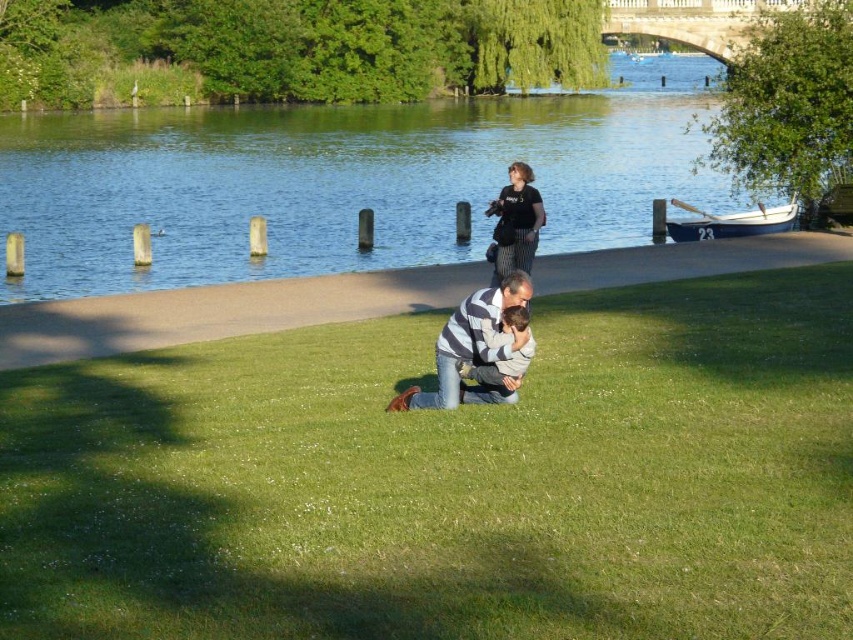
Can you confirm if green grass at center is wider than striped knit sweater at center?

Correct, the width of green grass at center exceeds that of striped knit sweater at center.

Who is more forward, (227,528) or (491,323)?

Point (227,528) is in front.

Which is behind, point (718, 308) or point (521, 339)?

The point (718, 308) is behind.

Where is `green grass at center`? green grass at center is located at coordinates (448, 480).

Is striped knit sweater at center in front of black cotton shirt at center?

Yes, striped knit sweater at center is in front of black cotton shirt at center.

Which is in front, point (459, 364) or point (497, 230)?

Point (459, 364)

Who is more forward, (444, 326) or (537, 192)?

Point (444, 326) is more forward.

This screenshot has width=853, height=640. I want to click on striped knit sweater at center, so click(473, 348).

Does green water at upper center have a greater height compared to black cotton shirt at center?

Indeed, green water at upper center has a greater height compared to black cotton shirt at center.

Is green water at upper center positioned in front of black cotton shirt at center?

No, it is behind black cotton shirt at center.

Which is in front, point (694, 64) or point (532, 236)?

Point (532, 236)

This screenshot has height=640, width=853. I want to click on green water at upper center, so click(341, 180).